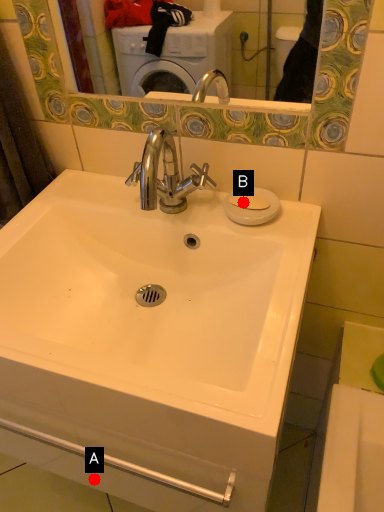
Question: Two points are circled on the image, labeled by A and B beside each circle. Which point is further to the camera?

Choices:
 (A) A is further
 (B) B is further

Answer: (A)